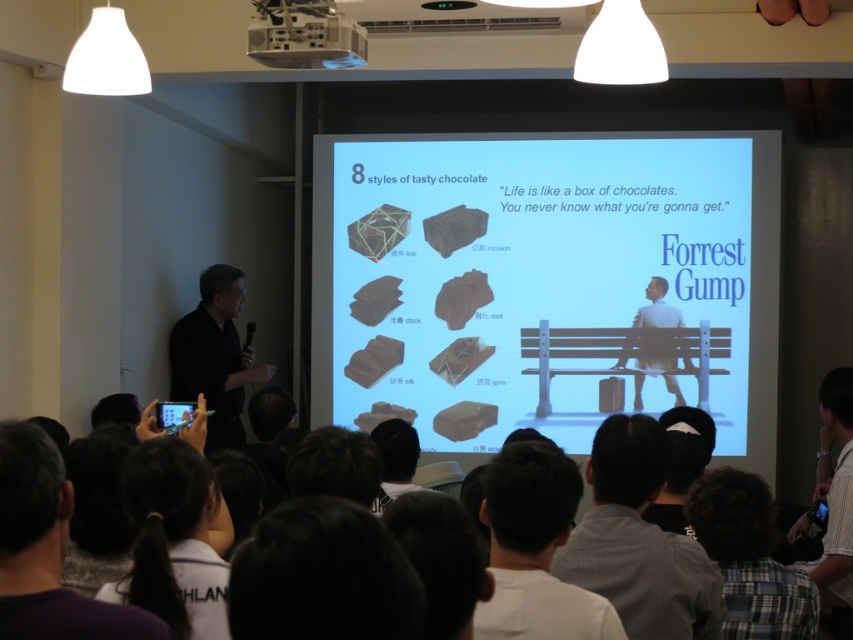
Is plaid shirt at lower right below white plastic projector at upper center?

Indeed, plaid shirt at lower right is positioned under white plastic projector at upper center.

Which of these two, plaid shirt at lower right or white plastic projector at upper center, stands shorter?

white plastic projector at upper center is shorter.

Where is `plaid shirt at lower right`? The width and height of the screenshot is (853, 640). plaid shirt at lower right is located at coordinates (749, 557).

Locate an element on the screen. The width and height of the screenshot is (853, 640). plaid shirt at lower right is located at coordinates (749, 557).

Can you confirm if dark purple shirt at lower left is smaller than matte black laptop at left?

No, dark purple shirt at lower left is not smaller than matte black laptop at left.

Who is taller, dark purple shirt at lower left or matte black laptop at left?

With more height is dark purple shirt at lower left.

Is point (10, 497) more distant than point (604, 380)?

No, (10, 497) is closer to viewer.

This screenshot has width=853, height=640. I want to click on dark purple shirt at lower left, so click(x=47, y=550).

You are a GUI agent. You are given a task and a screenshot of the screen. Output one action in this format:
    pyautogui.click(x=<x>, y=<y>)
    Task: Click on the light blue fabric man at center
    The width and height of the screenshot is (853, 640).
    Given the screenshot: What is the action you would take?
    coord(657,308)

Is point (682, 326) farther from camera compared to point (602, 410)?

That is False.

Who is more forward, (x=680, y=321) or (x=621, y=400)?

Positioned in front is point (x=680, y=321).

Locate an element on the screen. The image size is (853, 640). light blue fabric man at center is located at coordinates (657, 308).